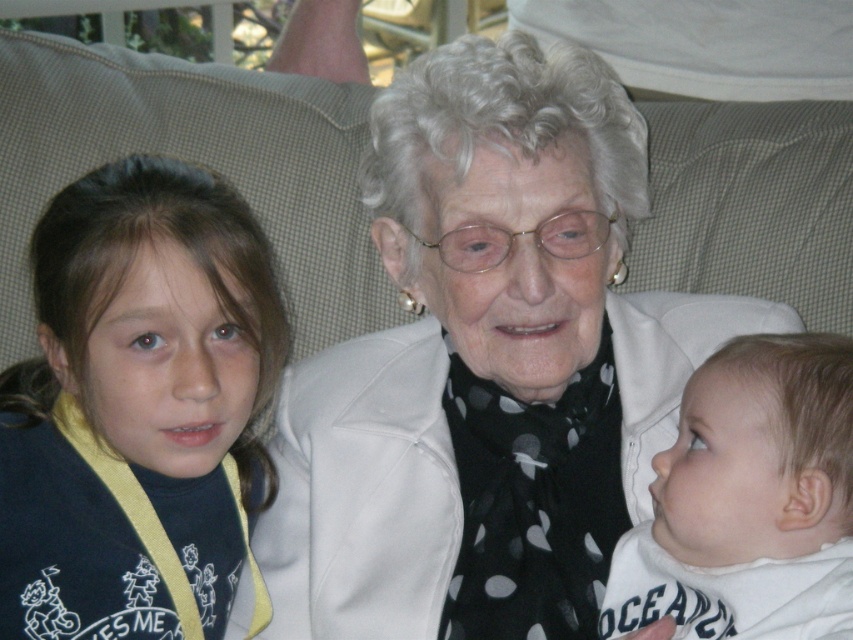
In the scene shown: Looking at the scene, which clothing item is positioned higher between the white matte jacket at center and the dark blue fabric shirt at left?

The white matte jacket at center is positioned higher than the dark blue fabric shirt at left.